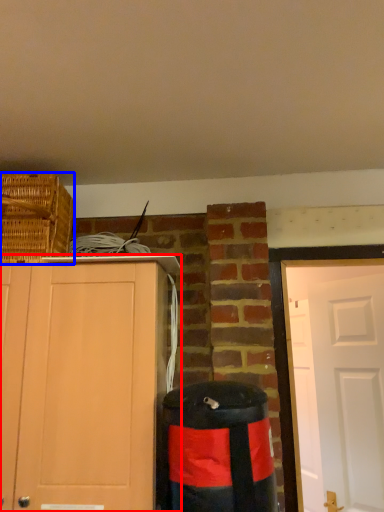
Question: Which object is further to the camera taking this photo, cabinetry (highlighted by a red box) or basket (highlighted by a blue box)?

Choices:
 (A) cabinetry
 (B) basket

Answer: (B)